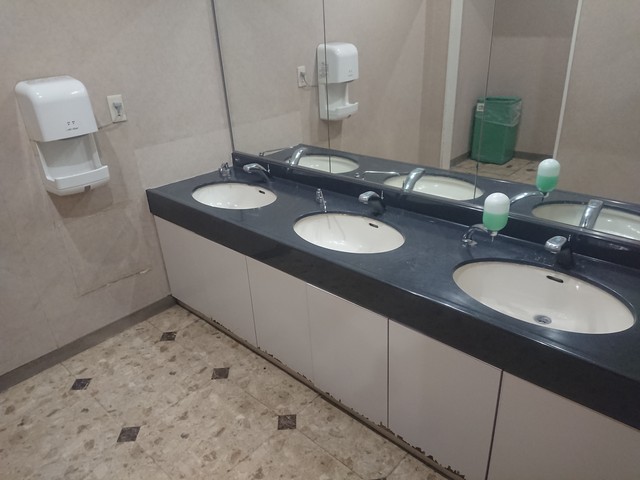
The image size is (640, 480). Identify the location of cabinet. tap(360, 360).